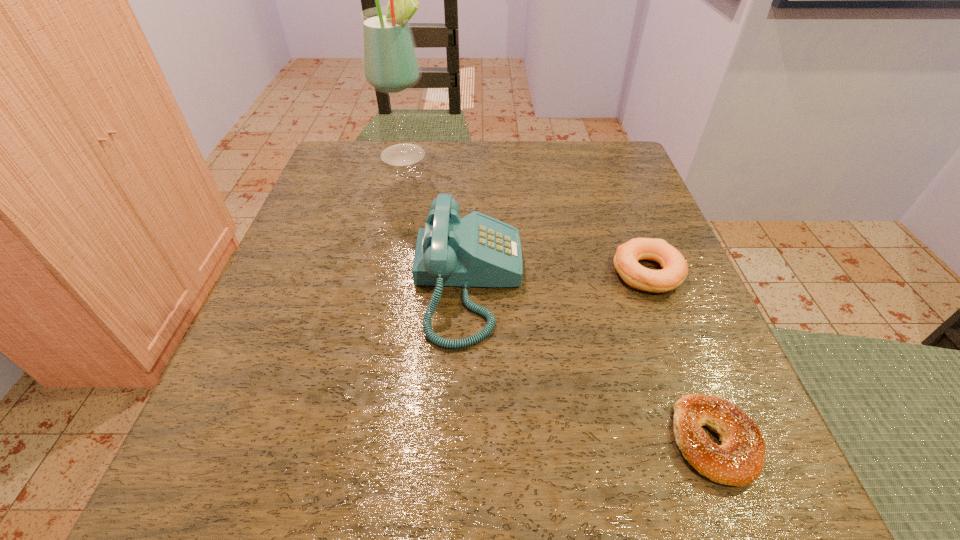
Find the location of a particular element. alcohol is located at coordinates pos(390,64).

In order to click on the farthest object in this screenshot , I will do `click(390, 64)`.

At what (x,y) coordinates should I click in order to perform the action: click on the third shortest object. Please return your answer as a coordinate pair (x, y). Looking at the image, I should click on (477, 250).

Locate an element on the screen. the second shortest object is located at coordinates (674, 270).

This screenshot has height=540, width=960. Identify the location of the taller bagel. (674, 270).

At what (x,y) coordinates should I click in order to perform the action: click on the shorter bagel. Please return your answer as a coordinate pair (x, y). This screenshot has width=960, height=540. Looking at the image, I should click on (739, 460).

The height and width of the screenshot is (540, 960). I want to click on the nearest object, so click(739, 460).

This screenshot has width=960, height=540. Identify the location of vacant space located 0.050m on the right of the tallest object. (455, 156).

Find the location of a particular element. This screenshot has width=960, height=540. free spot located on the dial of the telephone is located at coordinates (575, 284).

At what (x,y) coordinates should I click in order to perform the action: click on free space located on the back of the farther bagel. Please return your answer as a coordinate pair (x, y). Looking at the image, I should click on (x=615, y=190).